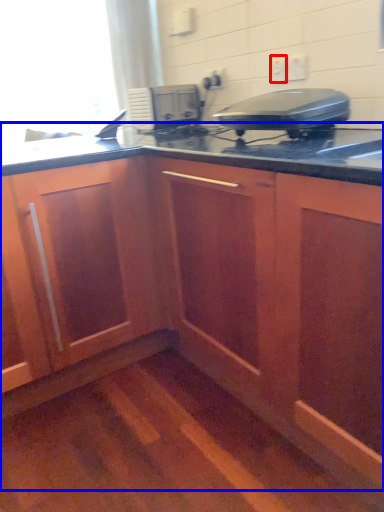
Question: Among these objects, which one is farthest to the camera, electric outlet (highlighted by a red box) or cabinetry (highlighted by a blue box)?

Choices:
 (A) electric outlet
 (B) cabinetry

Answer: (A)